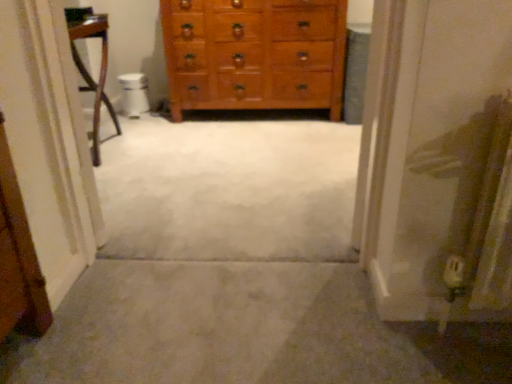
Question: From a real-world perspective, relative to wooden chest of drawers at center, is carpet at center vertically above or below?

Choices:
 (A) below
 (B) above

Answer: (A)

Question: Looking at their shapes, would you say carpet at center is wider or thinner than wooden chest of drawers at center?

Choices:
 (A) wide
 (B) thin

Answer: (A)

Question: Which object is the closest to the white glossy toilet bowl at center?

Choices:
 (A) carpet at center
 (B) wooden chest of drawers at center

Answer: (B)

Question: Which object is positioned farthest from the white glossy toilet bowl at center?

Choices:
 (A) wooden chest of drawers at center
 (B) carpet at center

Answer: (B)